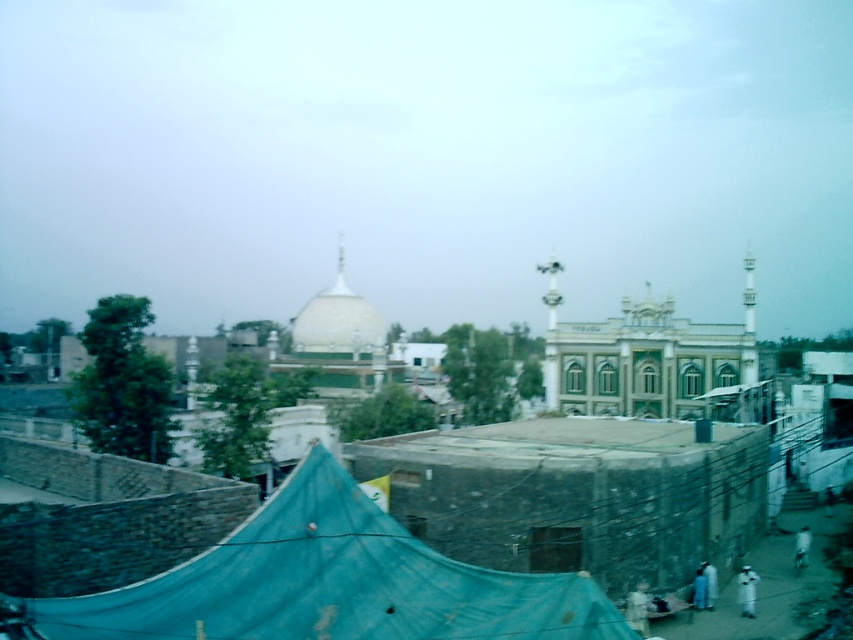
Does blue tarpaulin at center appear over white glossy dome at center?

Incorrect, blue tarpaulin at center is not positioned above white glossy dome at center.

Does blue tarpaulin at center come behind white glossy dome at center?

No, blue tarpaulin at center is in front of white glossy dome at center.

Between point (346, 636) and point (314, 342), which one is positioned behind?

The point (314, 342) is behind.

I want to click on blue tarpaulin at center, so click(x=329, y=582).